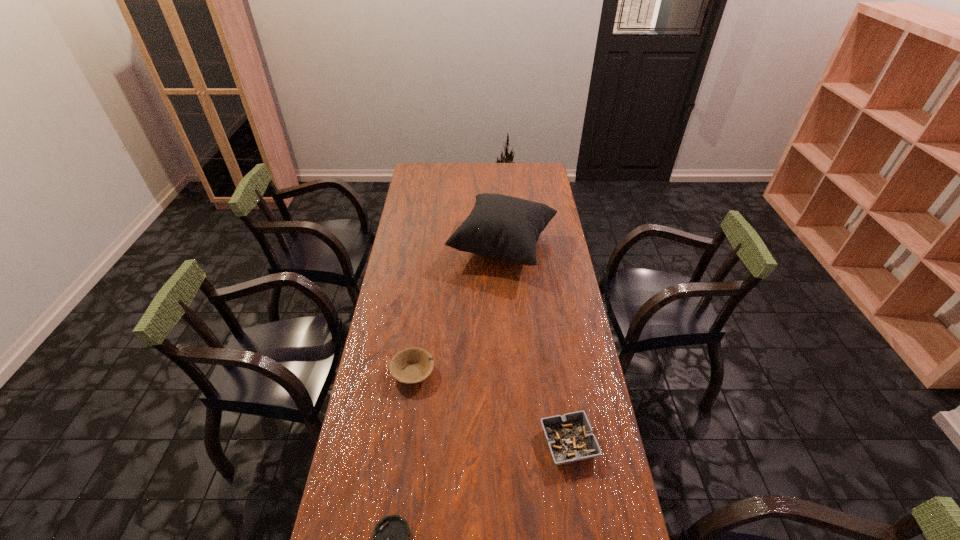
You are a GUI agent. You are given a task and a screenshot of the screen. Output one action in this format:
    pyautogui.click(x=<x>, y=<y>)
    Task: Click on the object that ranks as the third closest to the farthest object
    Image resolution: width=960 pixels, height=540 pixels.
    Given the screenshot: What is the action you would take?
    pyautogui.click(x=390, y=539)

Select which object appears as the third closest to the second nearest object. Please provide its 2D coordinates. Your answer should be formatted as a tuple, i.e. [(x, y)], where the tuple contains the x and y coordinates of a point satisfying the conditions above.

[(507, 228)]

The image size is (960, 540). What are the coordinates of `free space that satisfies the following two spatial constraints: 1. on the front side of the second farthest object; 2. on the left side of the right ashtray` in the screenshot? It's located at (403, 443).